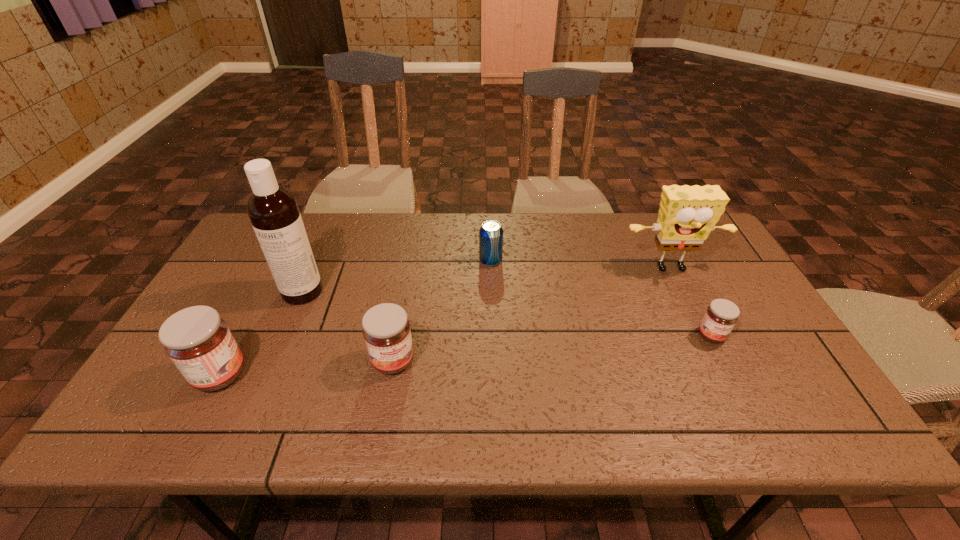
This screenshot has height=540, width=960. In order to click on vacant space that satisfies the following two spatial constraints: 1. on the label side of the tallest object; 2. on the right side of the shortest jam in this screenshot , I will do `click(284, 335)`.

You are a GUI agent. You are given a task and a screenshot of the screen. Output one action in this format:
    pyautogui.click(x=<x>, y=<y>)
    Task: Click on the vacant region that satisfies the following two spatial constraints: 1. on the label side of the rightmost jam; 2. on the left side of the dishwasher detergent
    
    Given the screenshot: What is the action you would take?
    pyautogui.click(x=284, y=335)